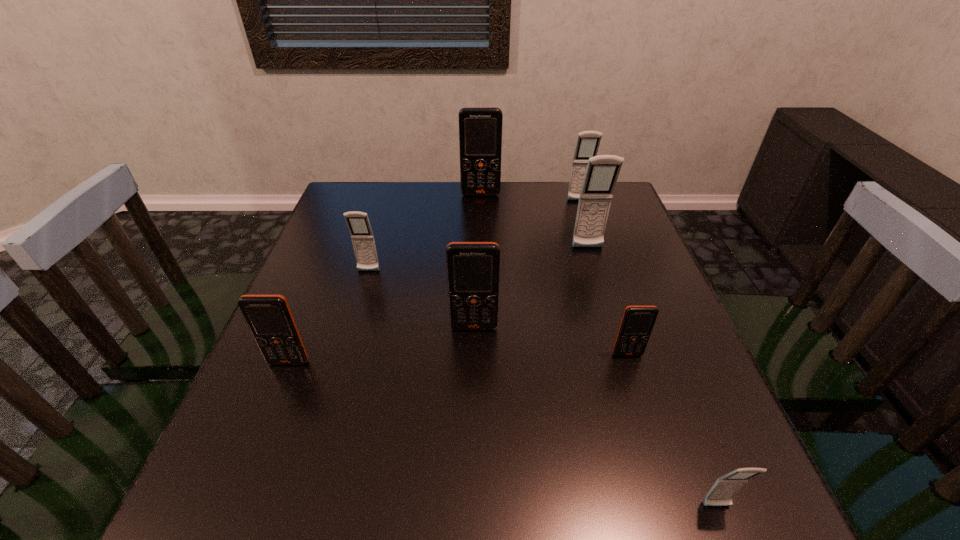
Identify the location of the biggest orange cellular telephone. (480, 128).

This screenshot has width=960, height=540. Find the location of `the farthest cellular telephone`. the farthest cellular telephone is located at coordinates (480, 128).

Identify the location of the sixth nearest object. coord(602,172).

Locate an element on the screen. The width and height of the screenshot is (960, 540). the sixth nearest cellular telephone is located at coordinates click(x=602, y=172).

Image resolution: width=960 pixels, height=540 pixels. In order to click on the seventh nearest cellular telephone in this screenshot , I will do `click(588, 142)`.

I want to click on the farthest gray cellular telephone, so click(x=588, y=142).

Find the location of a particular element. the fourth nearest cellular telephone is located at coordinates (473, 268).

Image resolution: width=960 pixels, height=540 pixels. I want to click on the third nearest orange cellular telephone, so click(x=473, y=268).

Where is `the seventh object from right to left`? The width and height of the screenshot is (960, 540). the seventh object from right to left is located at coordinates (358, 223).

The image size is (960, 540). What are the coordinates of `the third farthest gray cellular telephone` in the screenshot? It's located at (358, 223).